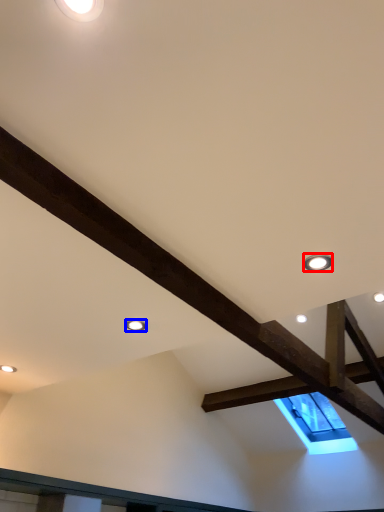
Question: Which point is further to the camera, droplight (highlighted by a red box) or droplight (highlighted by a blue box)?

Choices:
 (A) droplight
 (B) droplight

Answer: (B)